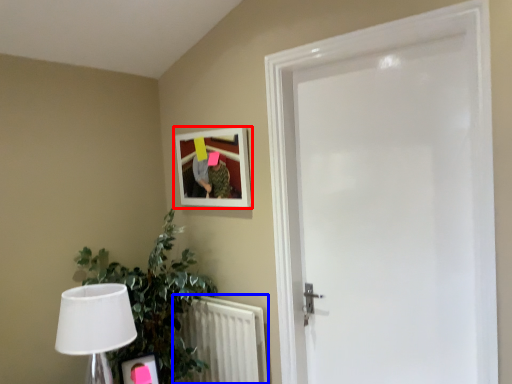
Question: Which object appears closest to the camera in this image, picture frame (highlighted by a red box) or radiator (highlighted by a blue box)?

Choices:
 (A) picture frame
 (B) radiator

Answer: (B)